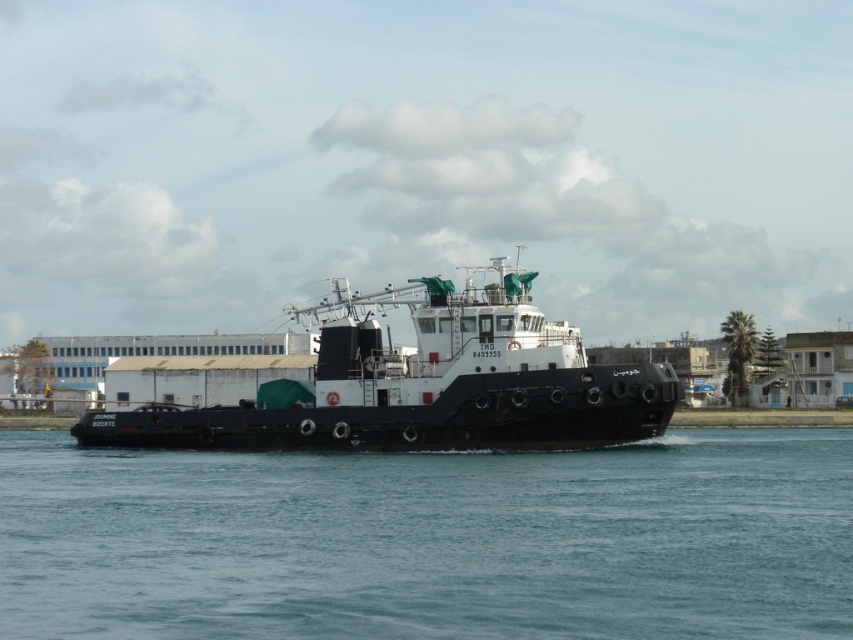
Can you confirm if clear blue water at center is bigger than black matte tugboat at center?

No.

You are a GUI agent. You are given a task and a screenshot of the screen. Output one action in this format:
    pyautogui.click(x=<x>, y=<y>)
    Task: Click on the clear blue water at center
    
    Given the screenshot: What is the action you would take?
    pyautogui.click(x=431, y=540)

Between point (744, 627) and point (448, 429), which one is positioned in front?

Positioned in front is point (744, 627).

At what (x,y) coordinates should I click in order to perform the action: click on clear blue water at center. Please return your answer as a coordinate pair (x, y). The image size is (853, 640). Looking at the image, I should click on (431, 540).